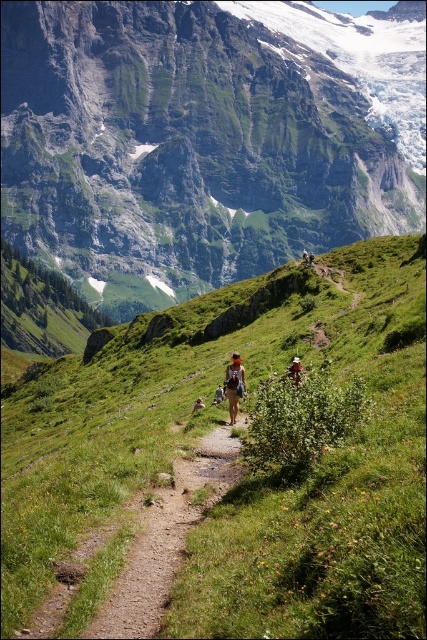
You are a hiker standing at the trailhead looking up the path. You see the rocky gray mountain at upper center and the khaki fabric backpack at center. Which object appears wider from your perspective?

The rocky gray mountain at upper center appears wider than the khaki fabric backpack at center because its width surpasses the backpack.

Looking at this image, you are a hiker trying to reach the rocky gray mountain at upper center. Based on the coordinates provided, is the mountain positioned closer to the top or the bottom of the image?

The rocky gray mountain at upper center is located at coordinates point (204, 138). Since the y coordinate is 0.480, which is closer to 0.5, it is positioned closer to the top of the image.